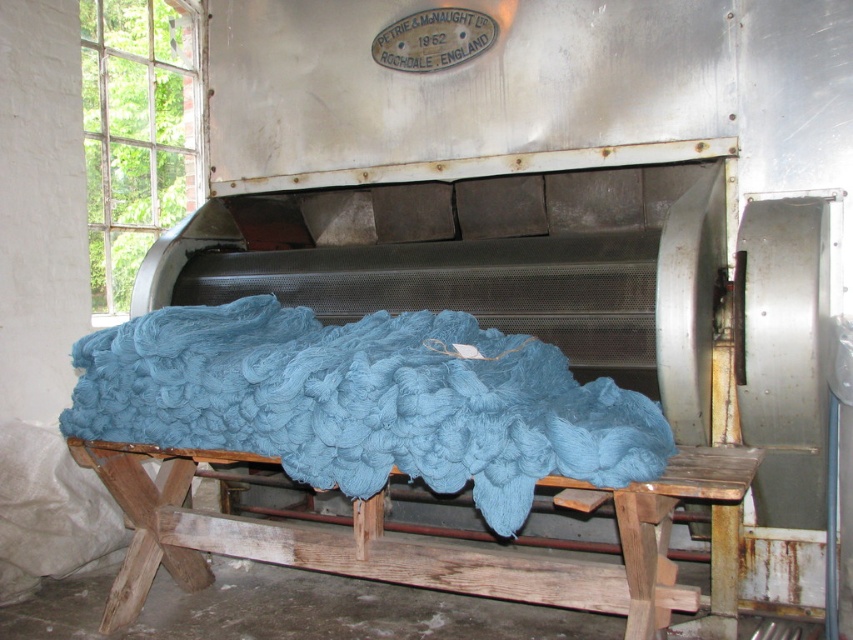
Question: Does teal woolen blanket at center have a greater width compared to wooden stool at center?

Choices:
 (A) no
 (B) yes

Answer: (A)

Question: Does teal woolen blanket at center appear over wooden stool at center?

Choices:
 (A) no
 (B) yes

Answer: (B)

Question: Can you confirm if teal woolen blanket at center is smaller than wooden stool at center?

Choices:
 (A) yes
 (B) no

Answer: (A)

Question: Which point is farther from the camera taking this photo?

Choices:
 (A) (146, 554)
 (B) (302, 358)

Answer: (A)